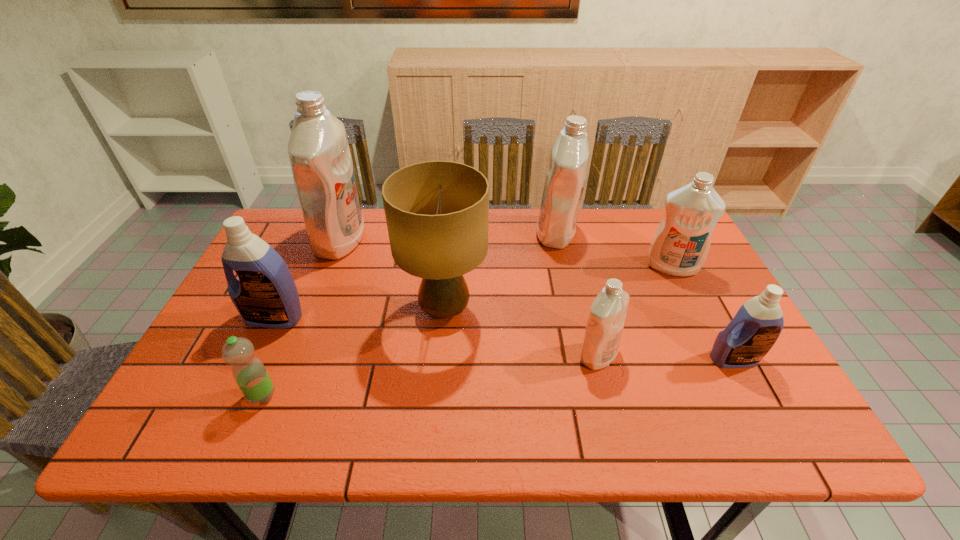
Image resolution: width=960 pixels, height=540 pixels. I want to click on free location located on the back of the nearest object, so tap(299, 309).

Find the location of a particular element. This screenshot has width=960, height=540. object that is at the near edge is located at coordinates (249, 372).

The width and height of the screenshot is (960, 540). What are the coordinates of `water bottle present at the left edge` in the screenshot? It's located at (249, 372).

Identify the location of object at the far left corner. (318, 149).

Locate an element on the screen. object that is at the near left corner is located at coordinates (249, 372).

Locate an element on the screen. The image size is (960, 540). free space at the far edge of the desktop is located at coordinates (355, 254).

Locate an element on the screen. The width and height of the screenshot is (960, 540). free space at the near edge is located at coordinates (625, 426).

Image resolution: width=960 pixels, height=540 pixels. In the image, there is a desktop. In order to click on vacant space at the left edge in this screenshot , I will do `click(293, 273)`.

Locate an element on the screen. Image resolution: width=960 pixels, height=540 pixels. vacant space at the far right corner of the desktop is located at coordinates (646, 252).

This screenshot has width=960, height=540. Identify the location of vacant point located between the beige lampshade and the third smallest white detergent. (500, 272).